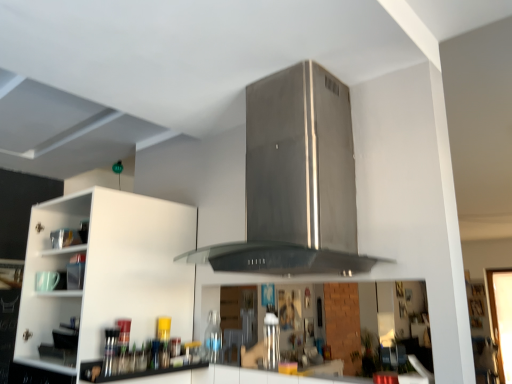
Question: From a real-world perspective, is stainless steel vent at center positioned over satin silver canister at center based on gravity?

Choices:
 (A) yes
 (B) no

Answer: (A)

Question: Is stainless steel vent at center facing towards satin silver canister at center?

Choices:
 (A) no
 (B) yes

Answer: (A)

Question: Does stainless steel vent at center have a smaller size compared to satin silver canister at center?

Choices:
 (A) no
 (B) yes

Answer: (A)

Question: Is stainless steel vent at center not inside satin silver canister at center?

Choices:
 (A) no
 (B) yes

Answer: (B)

Question: Can you confirm if stainless steel vent at center is shorter than satin silver canister at center?

Choices:
 (A) no
 (B) yes

Answer: (A)

Question: Does stainless steel vent at center come behind satin silver canister at center?

Choices:
 (A) yes
 (B) no

Answer: (B)

Question: Can you confirm if satin silver canister at center is positioned to the right of stainless steel vent at center?

Choices:
 (A) yes
 (B) no

Answer: (B)

Question: Is satin silver canister at center behind stainless steel vent at center?

Choices:
 (A) yes
 (B) no

Answer: (A)

Question: Is satin silver canister at center bigger than stainless steel vent at center?

Choices:
 (A) yes
 (B) no

Answer: (B)

Question: Is stainless steel vent at center at the back of satin silver canister at center?

Choices:
 (A) yes
 (B) no

Answer: (B)

Question: Is satin silver canister at center outside of stainless steel vent at center?

Choices:
 (A) no
 (B) yes

Answer: (B)

Question: From a real-world perspective, does satin silver canister at center sit lower than stainless steel vent at center?

Choices:
 (A) no
 (B) yes

Answer: (B)

Question: Is white matte cabinet at left oriented away from satin silver canister at center?

Choices:
 (A) yes
 (B) no

Answer: (B)